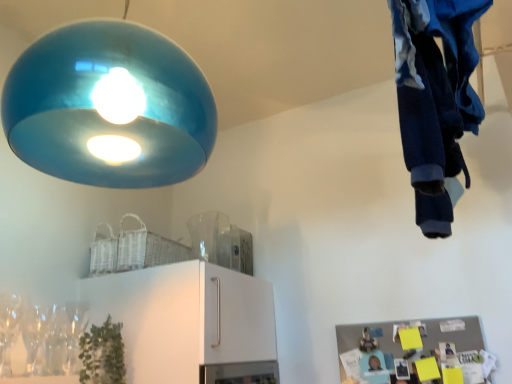
Question: From a real-world perspective, is blue cotton pants at upper right beneath glossy blue lampshade at upper left?

Choices:
 (A) no
 (B) yes

Answer: (B)

Question: Can you confirm if blue cotton pants at upper right is positioned to the left of glossy blue lampshade at upper left?

Choices:
 (A) yes
 (B) no

Answer: (B)

Question: Can you confirm if blue cotton pants at upper right is wider than glossy blue lampshade at upper left?

Choices:
 (A) no
 (B) yes

Answer: (A)

Question: Is blue cotton pants at upper right not inside glossy blue lampshade at upper left?

Choices:
 (A) yes
 (B) no

Answer: (A)

Question: Can you confirm if blue cotton pants at upper right is shorter than glossy blue lampshade at upper left?

Choices:
 (A) yes
 (B) no

Answer: (A)

Question: Does blue cotton pants at upper right turn towards glossy blue lampshade at upper left?

Choices:
 (A) no
 (B) yes

Answer: (A)

Question: Does clear glass wine glass at lower left have a lesser width compared to blue cotton pants at upper right?

Choices:
 (A) yes
 (B) no

Answer: (A)

Question: Is the depth of clear glass wine glass at lower left less than that of blue cotton pants at upper right?

Choices:
 (A) no
 (B) yes

Answer: (A)

Question: Are clear glass wine glass at lower left and blue cotton pants at upper right located far from each other?

Choices:
 (A) no
 (B) yes

Answer: (B)

Question: Is clear glass wine glass at lower left smaller than blue cotton pants at upper right?

Choices:
 (A) yes
 (B) no

Answer: (A)

Question: From a real-world perspective, is clear glass wine glass at lower left located higher than blue cotton pants at upper right?

Choices:
 (A) no
 (B) yes

Answer: (A)

Question: Is clear glass wine glass at lower left oriented away from blue cotton pants at upper right?

Choices:
 (A) no
 (B) yes

Answer: (A)

Question: Does green matte plant at lower left appear on the left side of clear glass wine glass at lower left?

Choices:
 (A) no
 (B) yes

Answer: (A)